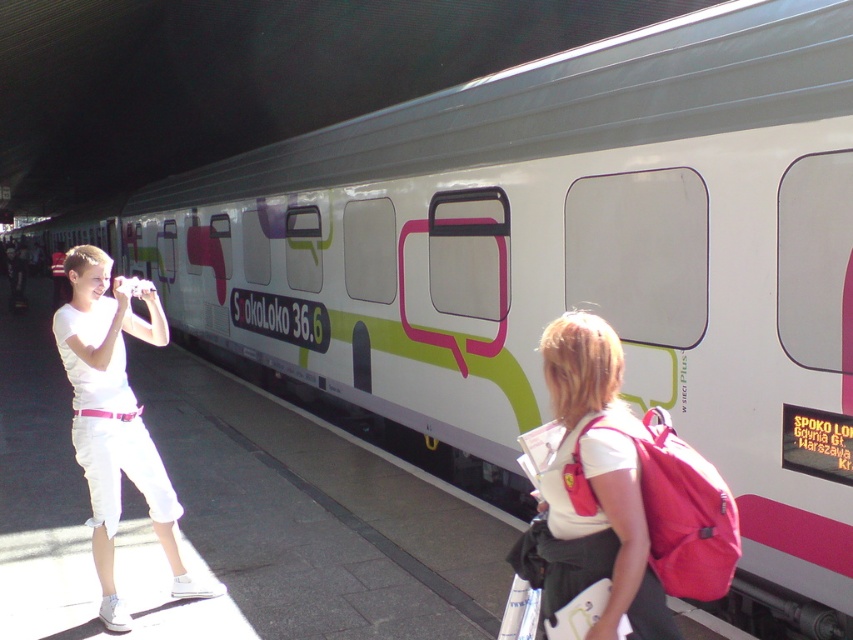
Question: Can you confirm if matte pink backpack at center is wider than white cotton shirt at left?

Choices:
 (A) yes
 (B) no

Answer: (B)

Question: Where is matte pink backpack at center located in relation to white cotton shirt at left in the image?

Choices:
 (A) below
 (B) above

Answer: (B)

Question: Which point is farther from the camera taking this photo?

Choices:
 (A) (529, 538)
 (B) (88, 524)

Answer: (B)

Question: Which point is closer to the camera?

Choices:
 (A) white cotton shirt at left
 (B) matte pink backpack at center

Answer: (B)

Question: Is matte pink backpack at center closer to the viewer compared to white cotton shirt at left?

Choices:
 (A) no
 (B) yes

Answer: (B)